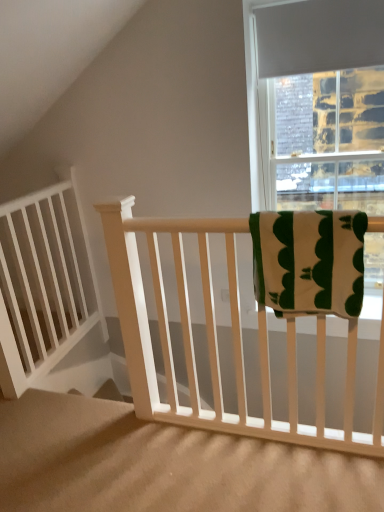
What is the approximate width of white matte balustrade at left?

white matte balustrade at left is 6.71 inches wide.

Find the location of a particular element. white wood stairs at center is located at coordinates (163, 464).

The height and width of the screenshot is (512, 384). Identify the location of white matte balustrade at left. (44, 284).

From their relative heights in the image, would you say white wood stairs at center is taller or shorter than white matte balustrade at left?

Considering their sizes, white wood stairs at center has less height than white matte balustrade at left.

Is white wood stairs at center outside of white matte balustrade at left?

That's correct, white wood stairs at center is outside of white matte balustrade at left.

In terms of size, does white wood stairs at center appear bigger or smaller than white matte balustrade at left?

Clearly, white wood stairs at center is larger in size than white matte balustrade at left.

From a real-world perspective, which is physically below, white matte balustrade at left or white wood stairs at center?

white wood stairs at center, from a real-world perspective.

Identify the location of stairs in front of the white matte balustrade at left. The height and width of the screenshot is (512, 384). (163, 464).

Which is farther from the camera, (267, 221) or (97, 505)?

Positioned behind is point (97, 505).

Is green cotton towel at upper right beside white wood stairs at center?

No, green cotton towel at upper right is not making contact with white wood stairs at center.

In terms of width, does green cotton towel at upper right look wider or thinner when compared to white wood stairs at center?

In the image, green cotton towel at upper right appears to be more narrow than white wood stairs at center.

From the image's perspective, is green cotton towel at upper right below white wood stairs at center?

No, from the image's perspective, green cotton towel at upper right is not below white wood stairs at center.

Is white matte balustrade at left facing towards green cotton towel at upper right?

Yes, white matte balustrade at left faces towards green cotton towel at upper right.

Is white matte balustrade at left touching green cotton towel at upper right?

No, white matte balustrade at left is not touching green cotton towel at upper right.

From the image's perspective, which object appears higher, white matte balustrade at left or green cotton towel at upper right?

green cotton towel at upper right, from the image's perspective.

Does point (68, 276) come behind point (313, 279)?

Yes, point (68, 276) is behind point (313, 279).

Between white wood stairs at center and green cotton towel at upper right, which one is positioned behind?

green cotton towel at upper right is behind.

From a real-world perspective, which object stands above the other?

In real-world perspective, green cotton towel at upper right is above.

Does white wood stairs at center have a larger size compared to green cotton towel at upper right?

Correct, white wood stairs at center is larger in size than green cotton towel at upper right.

At what (x,y) coordinates should I click in order to perform the action: click on beach towel above the white matte balustrade at left (from a real-world perspective). Please return your answer as a coordinate pair (x, y). Looking at the image, I should click on (309, 261).

Is green cotton towel at upper right next to white matte balustrade at left and touching it?

No, green cotton towel at upper right is not touching white matte balustrade at left.

Can you confirm if green cotton towel at upper right is positioned to the left of white matte balustrade at left?

No, green cotton towel at upper right is not to the left of white matte balustrade at left.

How different are the orientations of green cotton towel at upper right and white matte balustrade at left in degrees?

They differ by 89.7 degrees in their facing directions.

The image size is (384, 512). Identify the location of stairs located on the right of white matte balustrade at left. (163, 464).

What are the coordinates of `balustrade above the white wood stairs at center (from a real-world perspective)` in the screenshot? It's located at (44, 284).

Looking at the image, which one is located closer to white matte balustrade at left, white wood stairs at center or green cotton towel at upper right?

white wood stairs at center is closer to white matte balustrade at left.

Looking at the image, which one is located closer to white matte balustrade at left, green cotton towel at upper right or white wood stairs at center?

The object closer to white matte balustrade at left is white wood stairs at center.

Estimate the real-world distances between objects in this image. Which object is further from white wood stairs at center, white matte balustrade at left or green cotton towel at upper right?

green cotton towel at upper right is positioned further to the anchor white wood stairs at center.

When comparing their distances from green cotton towel at upper right, does white matte balustrade at left or white wood stairs at center seem further?

Among the two, white matte balustrade at left is located further to green cotton towel at upper right.

From the image, which object appears to be nearer to white wood stairs at center, green cotton towel at upper right or white matte balustrade at left?

white matte balustrade at left.

Which object lies nearer to the anchor point green cotton towel at upper right, white wood stairs at center or white matte balustrade at left?

white wood stairs at center lies closer to green cotton towel at upper right than the other object.

Locate an element on the screen. This screenshot has width=384, height=512. stairs between white matte balustrade at left and green cotton towel at upper right in the horizontal direction is located at coordinates (163, 464).